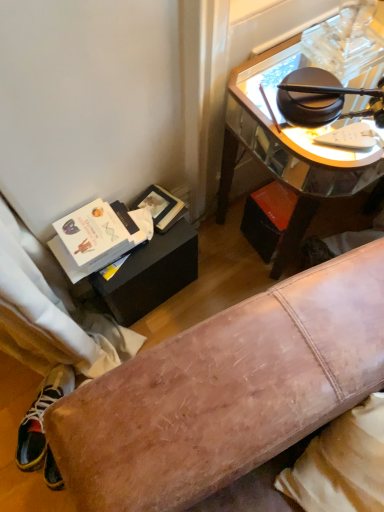
Question: Is multicolored fabric shoe at lower left to the left of shiny glass desk at upper right from the viewer's perspective?

Choices:
 (A) no
 (B) yes

Answer: (B)

Question: Does multicolored fabric shoe at lower left have a smaller size compared to shiny glass desk at upper right?

Choices:
 (A) yes
 (B) no

Answer: (A)

Question: Does multicolored fabric shoe at lower left have a lesser width compared to shiny glass desk at upper right?

Choices:
 (A) no
 (B) yes

Answer: (B)

Question: Is multicolored fabric shoe at lower left taller than shiny glass desk at upper right?

Choices:
 (A) no
 (B) yes

Answer: (A)

Question: Can you confirm if multicolored fabric shoe at lower left is positioned to the right of shiny glass desk at upper right?

Choices:
 (A) yes
 (B) no

Answer: (B)

Question: Is multicolored fabric shoe at lower left facing towards shiny glass desk at upper right?

Choices:
 (A) yes
 (B) no

Answer: (B)

Question: Can you confirm if shiny glass desk at upper right is thinner than multicolored fabric shoe at lower left?

Choices:
 (A) yes
 (B) no

Answer: (B)

Question: From the image's perspective, does shiny glass desk at upper right appear higher than multicolored fabric shoe at lower left?

Choices:
 (A) no
 (B) yes

Answer: (B)

Question: Does shiny glass desk at upper right come behind multicolored fabric shoe at lower left?

Choices:
 (A) no
 (B) yes

Answer: (A)

Question: Would you say shiny glass desk at upper right is outside multicolored fabric shoe at lower left?

Choices:
 (A) yes
 (B) no

Answer: (A)

Question: Considering the relative sizes of shiny glass desk at upper right and multicolored fabric shoe at lower left in the image provided, is shiny glass desk at upper right smaller than multicolored fabric shoe at lower left?

Choices:
 (A) yes
 (B) no

Answer: (B)

Question: Is shiny glass desk at upper right next to multicolored fabric shoe at lower left?

Choices:
 (A) no
 (B) yes

Answer: (A)

Question: In terms of width, does shiny glass desk at upper right look wider or thinner when compared to multicolored fabric shoe at lower left?

Choices:
 (A) thin
 (B) wide

Answer: (B)